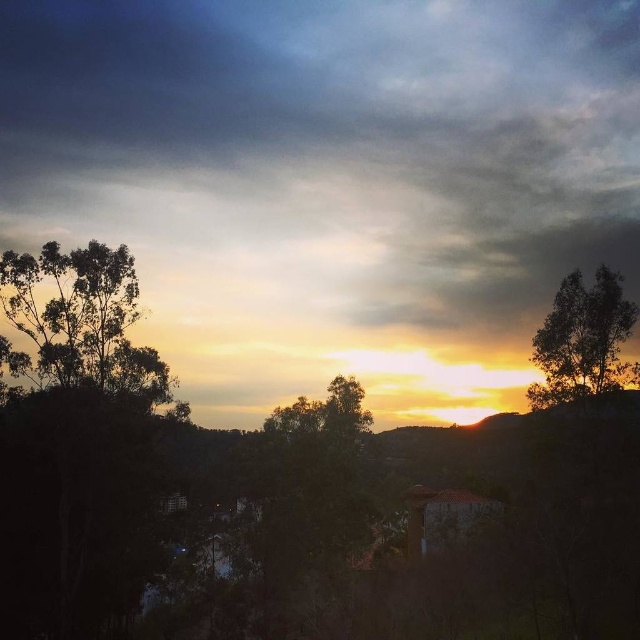
In the scene shown: Who is higher up, green leafy tree at left or silhouette leafy tree at upper right?

Positioned higher is silhouette leafy tree at upper right.

Is green leafy tree at left thinner than silhouette leafy tree at upper right?

In fact, green leafy tree at left might be wider than silhouette leafy tree at upper right.

Is point (131, 380) less distant than point (570, 296)?

No, it is behind (570, 296).

This screenshot has width=640, height=640. I want to click on green leafy tree at left, so click(81, 321).